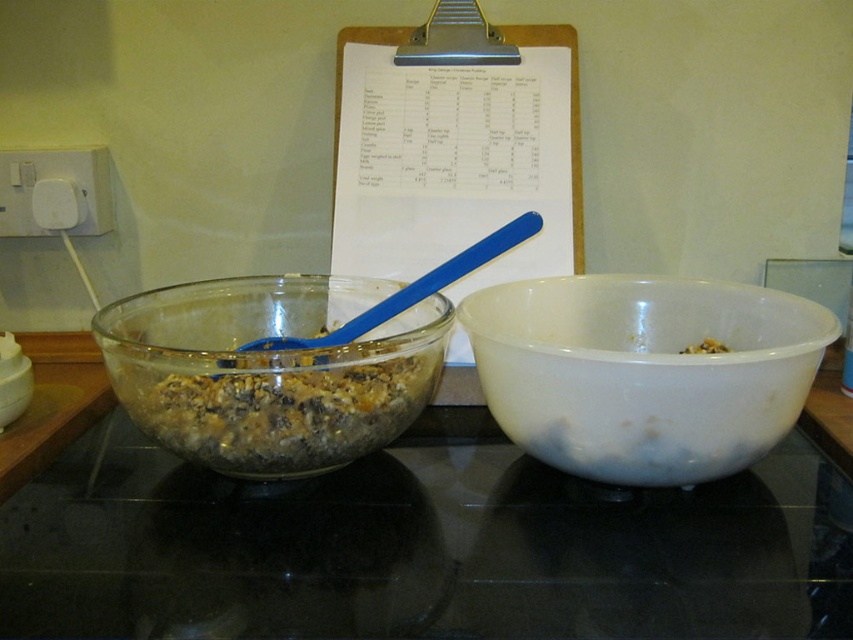
You are a chef preparing a recipe and need to pour the mixture from the white glossy bowl at right into the white matte bowl at right. Is this possible without moving either bowl?

The white glossy bowl at right is positioned under the white matte bowl at right, so pouring the mixture from the white glossy bowl at right into the white matte bowl at right is not possible without moving either bowl since they are stacked.

You are a chef preparing a recipe that requires both bowls to be placed exactly 25 centimeters apart. Based on the scene described, is the current distance between the translucent glass bowl at left and the white matte bowl at right sufficient for your needs?

The translucent glass bowl at left is 24.31 centimeters from the white matte bowl at right, which is slightly less than the required 25 centimeters. Therefore, the current distance is insufficient for the recipe requirement.